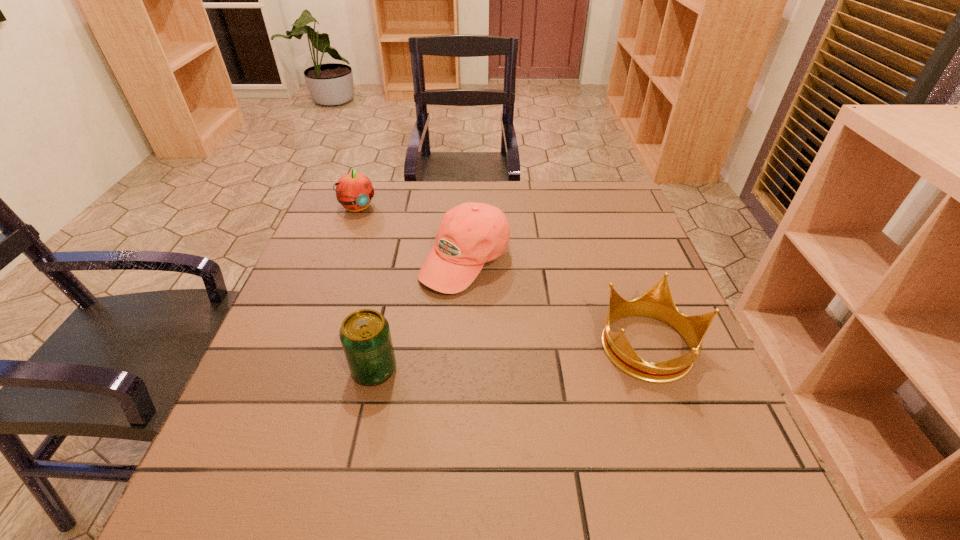
This screenshot has width=960, height=540. I want to click on blank space at the far right corner of the desktop, so click(620, 215).

Locate an element on the screen. free spot at the near right corner of the desktop is located at coordinates (666, 404).

The image size is (960, 540). What are the coordinates of `empty location between the rightmost object and the second object from left to right` in the screenshot? It's located at (513, 358).

Identify the location of vacant point located between the second object from left to right and the rightmost object. (513, 358).

This screenshot has height=540, width=960. I want to click on empty space that is in between the farthest object and the third object from right to left, so click(x=367, y=288).

Where is `free space between the second object from left to right and the farthest object`? free space between the second object from left to right and the farthest object is located at coordinates (367, 288).

The image size is (960, 540). Find the location of `blank region between the apple and the baseball cap`. blank region between the apple and the baseball cap is located at coordinates (412, 234).

Find the location of `vacant area between the crown and the second object from left to right`. vacant area between the crown and the second object from left to right is located at coordinates (513, 358).

I want to click on free space between the third object from right to left and the leftmost object, so click(x=367, y=288).

This screenshot has width=960, height=540. I want to click on vacant space in between the second object from right to left and the third object from right to left, so pyautogui.click(x=420, y=316).